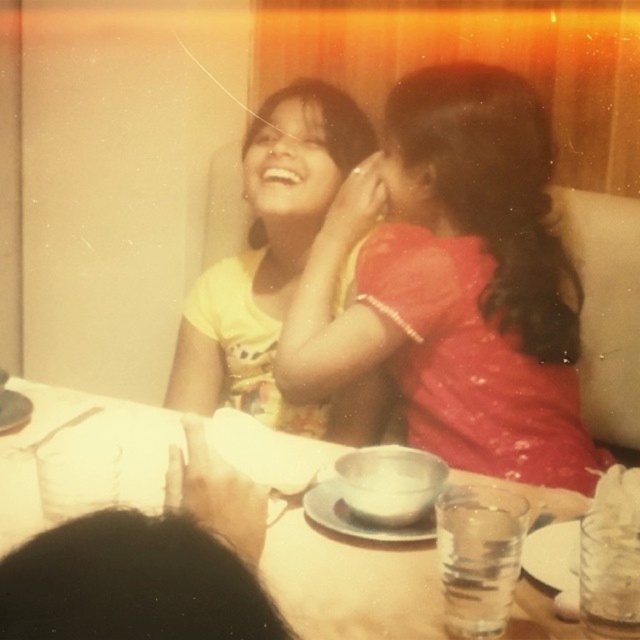
Looking at this image, does white paper napkin at upper left have a greater height compared to black hair at lower left?

Yes.

Does white paper napkin at upper left appear on the right side of black hair at lower left?

In fact, white paper napkin at upper left is to the left of black hair at lower left.

Describe the element at coordinates (348, 580) in the screenshot. I see `white paper napkin at upper left` at that location.

This screenshot has width=640, height=640. What are the coordinates of `white paper napkin at upper left` in the screenshot? It's located at (348, 580).

Between matte red dress at center and yellow printed fabric at upper left, which one has more height?

matte red dress at center

Is matte red dress at center positioned before yellow printed fabric at upper left?

That is True.

The image size is (640, 640). Identify the location of matte red dress at center. (456, 282).

Which is below, matte red dress at center or white paper napkin at upper left?

Positioned lower is white paper napkin at upper left.

Which is above, matte red dress at center or white paper napkin at upper left?

matte red dress at center is higher up.

Is point (577, 385) less distant than point (150, 509)?

That is False.

Locate an element on the screen. matte red dress at center is located at coordinates (456, 282).